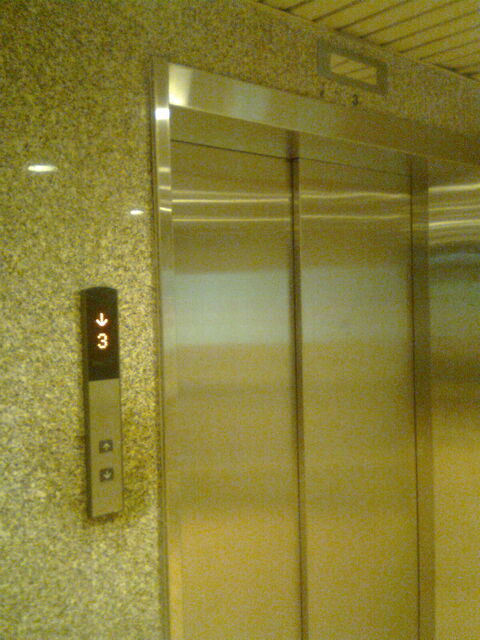
Where is `digital display`? digital display is located at coordinates (106, 339).